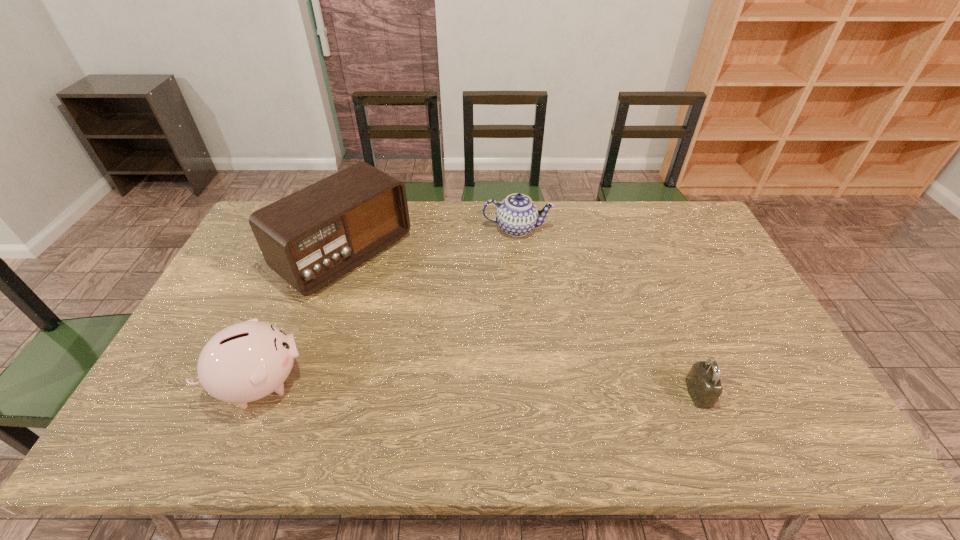
Image resolution: width=960 pixels, height=540 pixels. What are the coordinates of `free spot that satisfies the following two spatial constraints: 1. on the front side of the shortest object; 2. at the front of the tallest object near the keyhole` in the screenshot? It's located at (299, 393).

In order to click on free location that satisfies the following two spatial constraints: 1. on the back side of the third tallest object; 2. on the left side of the piggy bank in this screenshot , I will do `click(324, 229)`.